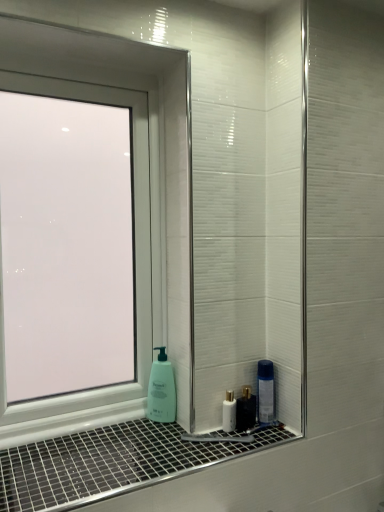
This screenshot has height=512, width=384. What do you see at coordinates (110, 463) in the screenshot?
I see `white glossy window sill at lower center` at bounding box center [110, 463].

Locate an element on the screen. green matte soap dispenser at lower center is located at coordinates (161, 390).

You are a GUI agent. You are given a task and a screenshot of the screen. Output one action in this format:
    pyautogui.click(x=<x>, y=<y>)
    Task: Click on the white glossy window sill at lower center
    This screenshot has height=512, width=384.
    Given the screenshot: What is the action you would take?
    pyautogui.click(x=110, y=463)

Would you say white glossy window sill at lower center is inside or outside transparent glass window at left?

white glossy window sill at lower center exists outside the volume of transparent glass window at left.

From the image's perspective, is white glossy window sill at lower center located above transparent glass window at left?

No, from the image's perspective, white glossy window sill at lower center is not on top of transparent glass window at left.

Can you confirm if white glossy window sill at lower center is shorter than transparent glass window at left?

Correct, white glossy window sill at lower center is not as tall as transparent glass window at left.

From a real-world perspective, is green matte soap dispenser at lower center under white glossy window sill at lower center?

No, from a real-world perspective, green matte soap dispenser at lower center is not beneath white glossy window sill at lower center.

Considering the relative sizes of green matte soap dispenser at lower center and white glossy window sill at lower center in the image provided, is green matte soap dispenser at lower center smaller than white glossy window sill at lower center?

Correct, green matte soap dispenser at lower center occupies less space than white glossy window sill at lower center.

Identify the location of window sill in front of the green matte soap dispenser at lower center. Image resolution: width=384 pixels, height=512 pixels. (110, 463).

Looking at this image, considering the positions of objects green matte soap dispenser at lower center and white glossy window sill at lower center in the image provided, who is in front, green matte soap dispenser at lower center or white glossy window sill at lower center?

white glossy window sill at lower center is closer to the camera.

Can you confirm if white glossy mouthwash at lower center is smaller than transparent glass window at left?

Correct, white glossy mouthwash at lower center occupies less space than transparent glass window at left.

From the picture: Is white glossy mouthwash at lower center to the left or to the right of transparent glass window at left in the image?

white glossy mouthwash at lower center is positioned on transparent glass window at left's right side.

In terms of height, does white glossy mouthwash at lower center look taller or shorter compared to transparent glass window at left?

Clearly, white glossy mouthwash at lower center is shorter compared to transparent glass window at left.

Which of these two, white glossy mouthwash at lower center or transparent glass window at left, is thinner?

Thinner between the two is white glossy mouthwash at lower center.

How different are the orientations of white glossy mouthwash at lower center and green matte soap dispenser at lower center in degrees?

There is a 31.3-degree angle between the facing directions of white glossy mouthwash at lower center and green matte soap dispenser at lower center.

Can you confirm if white glossy mouthwash at lower center is taller than green matte soap dispenser at lower center?

No.

Could you tell me if white glossy mouthwash at lower center is turned towards green matte soap dispenser at lower center?

No, white glossy mouthwash at lower center is not turned towards green matte soap dispenser at lower center.

From the image's perspective, between white glossy mouthwash at lower center and green matte soap dispenser at lower center, who is located below?

white glossy mouthwash at lower center, from the image's perspective.

Between green matte soap dispenser at lower center and white glossy mouthwash at lower center, which one has larger width?

white glossy mouthwash at lower center.

Is green matte soap dispenser at lower center in contact with white glossy mouthwash at lower center?

There is a gap between green matte soap dispenser at lower center and white glossy mouthwash at lower center.

What's the angular difference between green matte soap dispenser at lower center and white glossy mouthwash at lower center's facing directions?

They differ by 31.3 degrees in their facing directions.

Is point (160, 407) closer or farther from the camera than point (226, 397)?

Point (160, 407) is positioned farther from the camera compared to point (226, 397).

Where is `window located above the green matte soap dispenser at lower center (from a real-world perspective)`? The width and height of the screenshot is (384, 512). window located above the green matte soap dispenser at lower center (from a real-world perspective) is located at coordinates (135, 251).

How much distance is there between green matte soap dispenser at lower center and transparent glass window at left?

The distance of green matte soap dispenser at lower center from transparent glass window at left is 11.37 inches.

How different are the orientations of green matte soap dispenser at lower center and transparent glass window at left in degrees?

22.4 degrees.

Is point (155, 362) behind point (147, 214)?

No, (155, 362) is in front of (147, 214).

Is transparent glass window at left not inside white glossy window sill at lower center?

Indeed, transparent glass window at left is completely outside white glossy window sill at lower center.

Consider the image. Is transparent glass window at left oriented away from white glossy window sill at lower center?

No, transparent glass window at left's orientation is not away from white glossy window sill at lower center.

How different are the orientations of transparent glass window at left and white glossy window sill at lower center in degrees?

transparent glass window at left and white glossy window sill at lower center are facing 0.00238 degrees away from each other.

Is transparent glass window at left taller than white glossy window sill at lower center?

Yes, transparent glass window at left is taller than white glossy window sill at lower center.

Find the location of a particular element. window sill in front of the transparent glass window at left is located at coordinates (110, 463).

This screenshot has width=384, height=512. What are the coordinates of `soap dispenser behind the white glossy window sill at lower center` in the screenshot? It's located at (161, 390).

From the image, which object appears to be farther from white glossy mouthwash at lower center, white glossy window sill at lower center or transparent glass window at left?

transparent glass window at left lies further to white glossy mouthwash at lower center than the other object.

Considering their positions, is green matte soap dispenser at lower center positioned further to white glossy window sill at lower center than transparent glass window at left?

transparent glass window at left is further to white glossy window sill at lower center.

From the image, which object appears to be nearer to white glossy mouthwash at lower center, green matte soap dispenser at lower center or transparent glass window at left?

green matte soap dispenser at lower center lies closer to white glossy mouthwash at lower center than the other object.

Looking at the image, which one is located further to white glossy window sill at lower center, green matte soap dispenser at lower center or white glossy mouthwash at lower center?

white glossy mouthwash at lower center is further to white glossy window sill at lower center.

When comparing their distances from white glossy window sill at lower center, does white glossy mouthwash at lower center or green matte soap dispenser at lower center seem closer?

green matte soap dispenser at lower center.

Consider the image. Considering their positions, is green matte soap dispenser at lower center positioned closer to white glossy mouthwash at lower center than white glossy window sill at lower center?

The object closer to white glossy mouthwash at lower center is green matte soap dispenser at lower center.

When comparing their distances from transparent glass window at left, does white glossy mouthwash at lower center or green matte soap dispenser at lower center seem closer?

green matte soap dispenser at lower center is positioned closer to the anchor transparent glass window at left.

Which object lies nearer to the anchor point transparent glass window at left, white glossy window sill at lower center or white glossy mouthwash at lower center?

white glossy window sill at lower center.

Find the location of `mouthwash between white glossy window sill at lower center and green matte soap dispenser at lower center from front to back`. mouthwash between white glossy window sill at lower center and green matte soap dispenser at lower center from front to back is located at coordinates (229, 412).

The image size is (384, 512). Find the location of `soap dispenser that lies between transparent glass window at left and white glossy window sill at lower center from top to bottom`. soap dispenser that lies between transparent glass window at left and white glossy window sill at lower center from top to bottom is located at coordinates (161, 390).

The width and height of the screenshot is (384, 512). Identify the location of mouthwash between transparent glass window at left and white glossy window sill at lower center vertically. (229, 412).

Locate an element on the screen. soap dispenser between transparent glass window at left and white glossy mouthwash at lower center in the vertical direction is located at coordinates (161, 390).